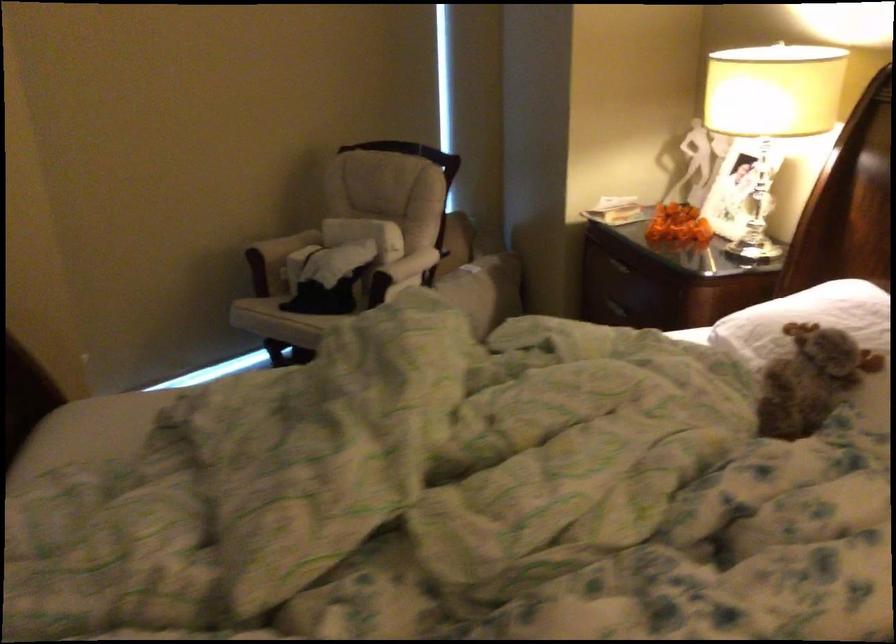
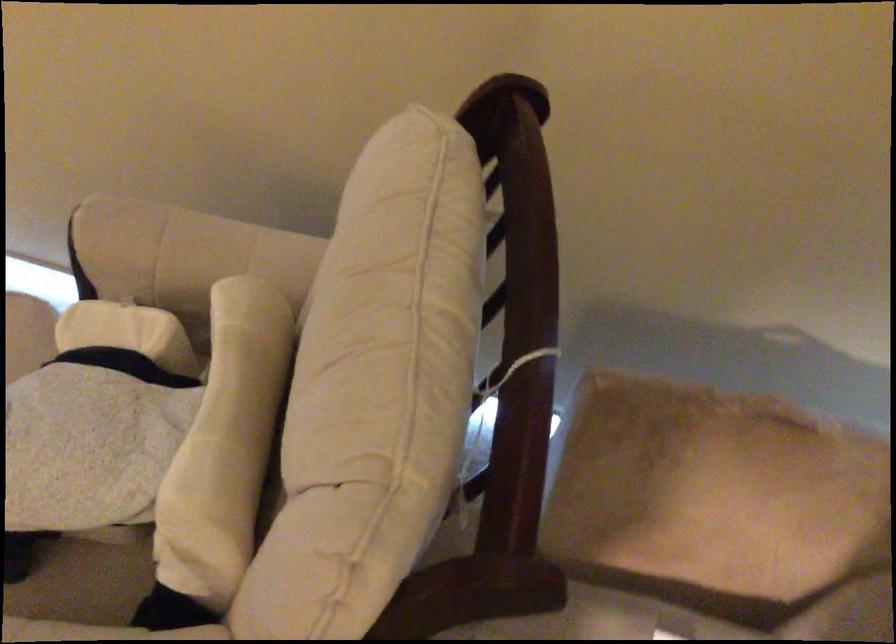
The point at (286, 241) is marked in the first image. Where is the corresponding point in the second image?

(181, 250)